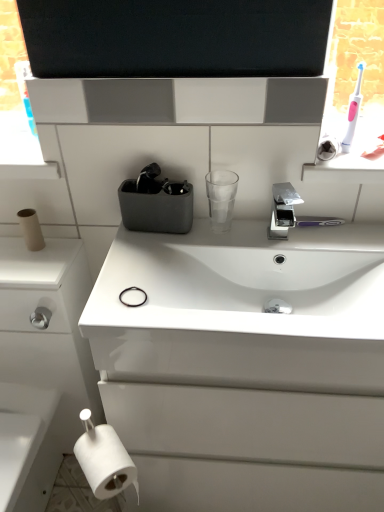
Where is `empty space that is to the right of chrome metallic faucet at center`? This screenshot has height=512, width=384. empty space that is to the right of chrome metallic faucet at center is located at coordinates (329, 240).